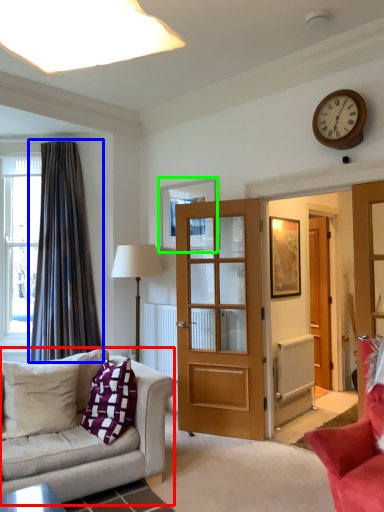
Question: Considering the real-world distances, which object is closest to studio couch (highlighted by a red box)? curtain (highlighted by a blue box) or picture frame (highlighted by a green box).

Choices:
 (A) curtain
 (B) picture frame

Answer: (A)